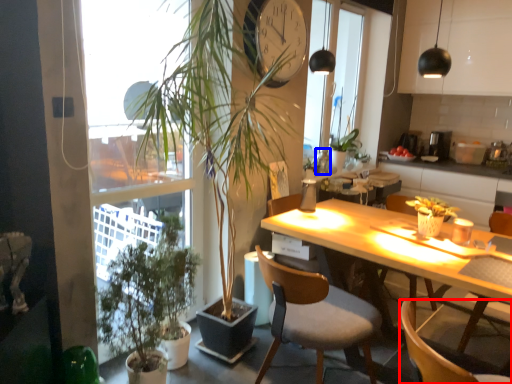
Question: Among these objects, which one is nearest to the camera, chair (highlighted by a red box) or bottle (highlighted by a blue box)?

Choices:
 (A) chair
 (B) bottle

Answer: (A)